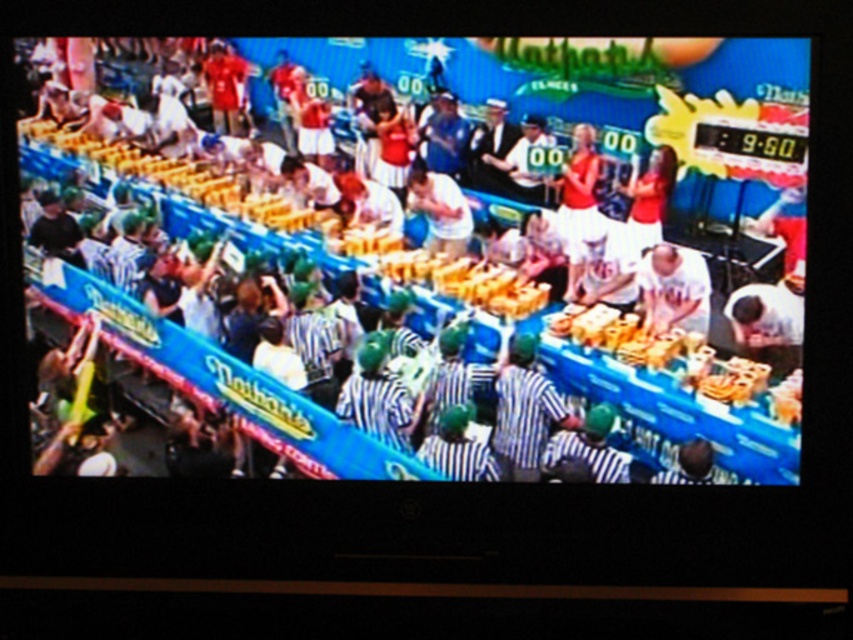
Does white striped shirt at center have a lesser height compared to white matte shirt at center?

Incorrect, white striped shirt at center's height does not fall short of white matte shirt at center's.

Which is below, white striped shirt at center or white matte shirt at center?

white striped shirt at center is below.

Who is more distant from viewer, [553,256] or [459,250]?

The point [459,250] is behind.

You are a GUI agent. You are given a task and a screenshot of the screen. Output one action in this format:
    pyautogui.click(x=<x>, y=<y>)
    Task: Click on the white striped shirt at center
    The image size is (853, 640).
    Given the screenshot: What is the action you would take?
    pyautogui.click(x=425, y=237)